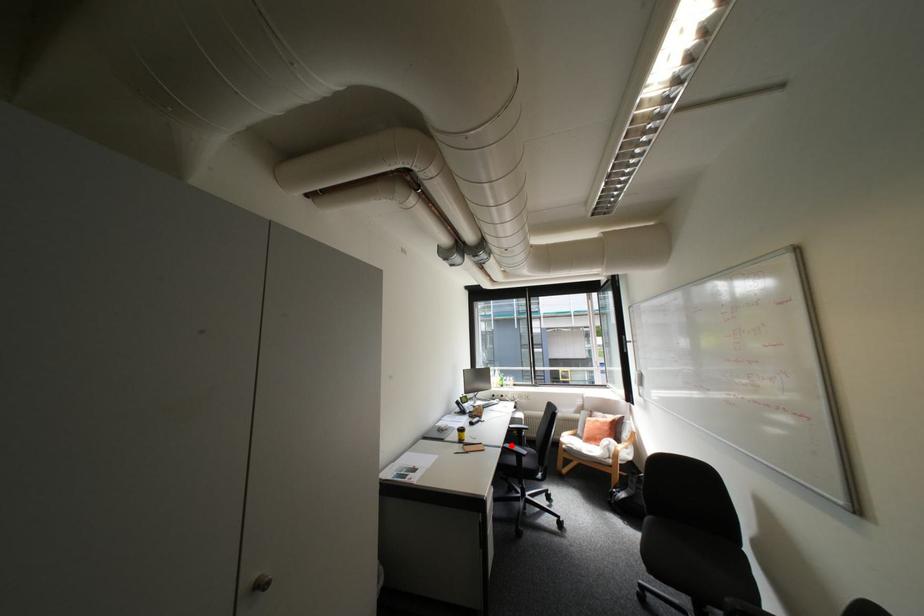
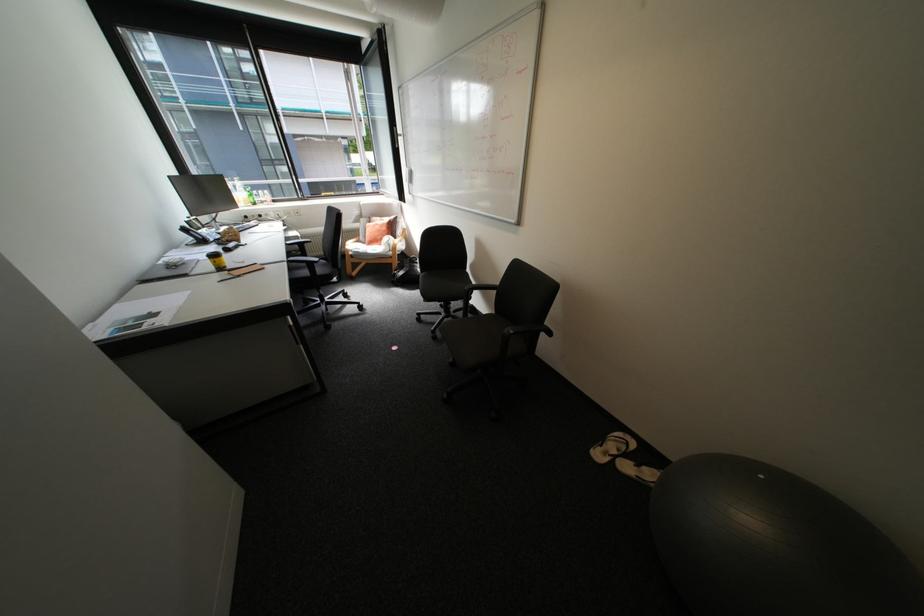
Question: I am providing you with two images of the same scene from different viewpoints. A red point is shown in image1. For the corresponding object point in image2, is it positioned nearer or farther from the camera?

Choices:
 (A) Nearer
 (B) Farther

Answer: (A)